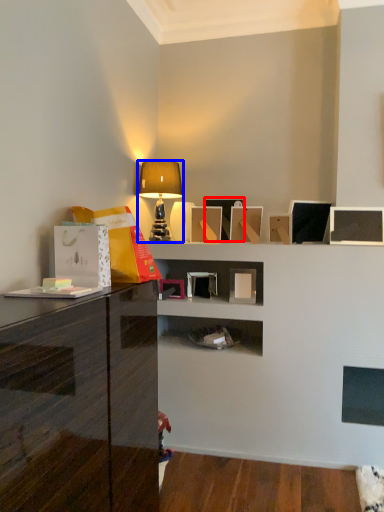
Question: Which point is closer to the camera, picture frame (highlighted by a red box) or lamp (highlighted by a blue box)?

Choices:
 (A) picture frame
 (B) lamp

Answer: (B)